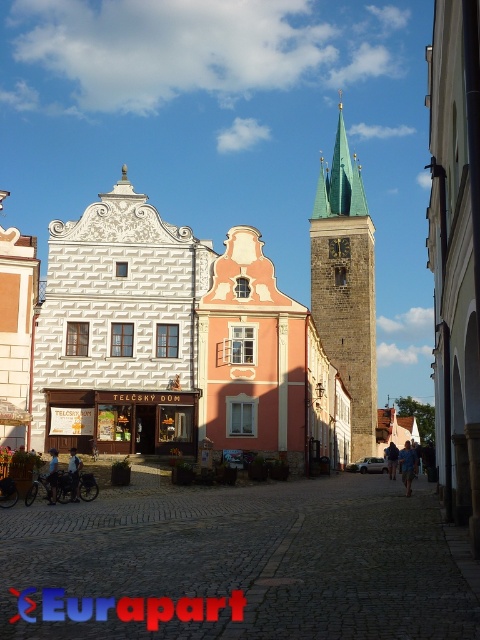
Is stone tower at center taller than gold textured clock at center?

Correct, stone tower at center is much taller as gold textured clock at center.

Between point (352, 452) and point (335, 240), which one is positioned behind?

The point (335, 240) is more distant.

The image size is (480, 640). Describe the element at coordinates (346, 285) in the screenshot. I see `stone tower at center` at that location.

The width and height of the screenshot is (480, 640). In order to click on stone tower at center in this screenshot , I will do `click(346, 285)`.